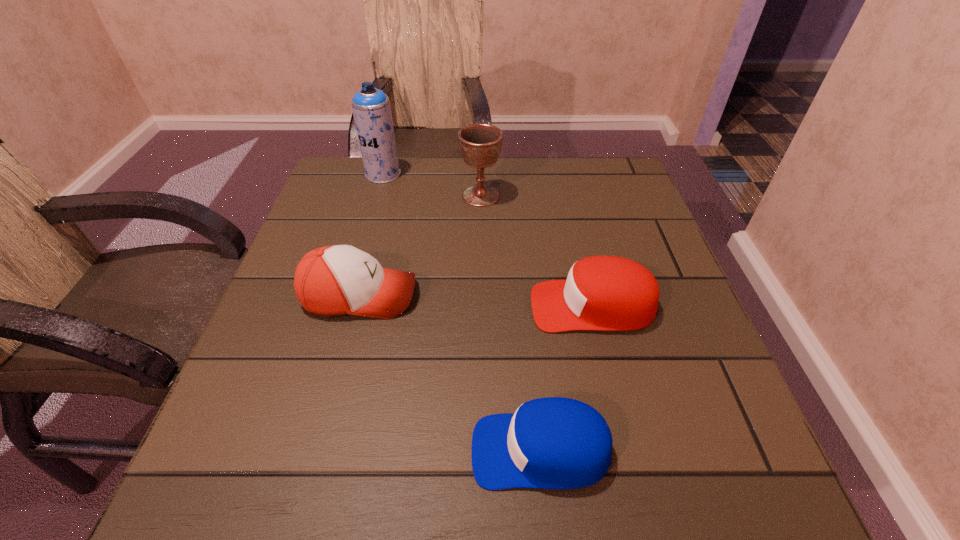
The height and width of the screenshot is (540, 960). What are the coordinates of `aerosol can` in the screenshot? It's located at (371, 108).

Identify the location of the tallest object. The width and height of the screenshot is (960, 540). (371, 108).

At what (x,y) coordinates should I click in order to perform the action: click on the fourth shortest object. Please return your answer as a coordinate pair (x, y). Looking at the image, I should click on click(480, 144).

Where is `chalice`? chalice is located at coordinates (480, 144).

Locate an element on the screen. This screenshot has width=960, height=540. the leftmost baseball cap is located at coordinates (335, 280).

Locate an element on the screen. Image resolution: width=960 pixels, height=540 pixels. the nearest object is located at coordinates (550, 443).

This screenshot has width=960, height=540. In order to click on the nearest baseball cap in this screenshot , I will do `click(550, 443)`.

The image size is (960, 540). What are the coordinates of `vacant point located on the right of the tallest object` in the screenshot? It's located at (513, 174).

You are a GUI agent. You are given a task and a screenshot of the screen. Output one action in this format:
    pyautogui.click(x=<x>, y=<y>)
    Task: Click on the vacant space located 0.220m on the right of the chalice
    This screenshot has width=960, height=540.
    Given the screenshot: What is the action you would take?
    pyautogui.click(x=588, y=195)

Where is `free space located 0.060m on the front-facing side of the leftmost baseball cap`? The image size is (960, 540). free space located 0.060m on the front-facing side of the leftmost baseball cap is located at coordinates (447, 295).